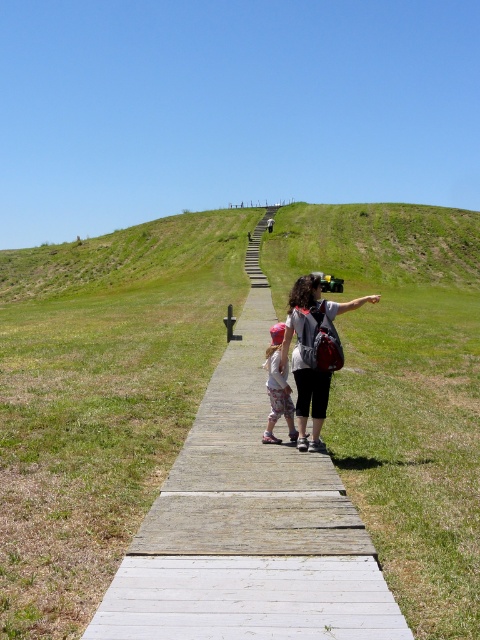
Question: Which point is farther to the camera?

Choices:
 (A) (297, 292)
 (B) (180, 579)

Answer: (A)

Question: Estimate the real-world distances between objects in this image. Which object is farther from the green grassy hillside at upper center?

Choices:
 (A) floral-patterned dress at center
 (B) wooden boardwalk at center
 (C) matte gray backpack at center

Answer: (A)

Question: Can you confirm if wooden boardwalk at center is positioned below matte gray backpack at center?

Choices:
 (A) yes
 (B) no

Answer: (A)

Question: Is wooden boardwalk at center further to camera compared to floral-patterned dress at center?

Choices:
 (A) yes
 (B) no

Answer: (B)

Question: Does wooden boardwalk at center have a lesser width compared to green grassy hillside at upper center?

Choices:
 (A) no
 (B) yes

Answer: (B)

Question: Which object is closer to the camera taking this photo?

Choices:
 (A) floral-patterned dress at center
 (B) wooden boardwalk at center

Answer: (B)